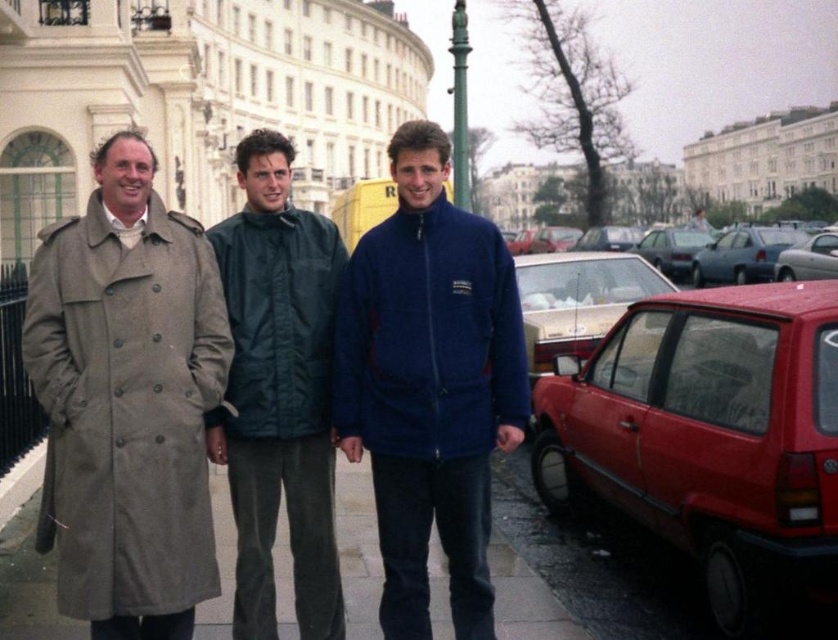
You are a pedestrian standing on the sidewalk and want to cross the street to reach the shiny red hatchback at right and the navy fleece jacket at center. Which object will you reach first?

The shiny red hatchback at right is closer to the viewer than the navy fleece jacket at center, so you will reach the shiny red hatchback at right first.

You are a pedestrian standing on the sidewalk and want to cross the street safely. The shiny red hatchback at right and the metallic silver sedan at center right are parked. Which car should you avoid walking behind because it might start moving first?

You should avoid walking behind the shiny red hatchback at right because it is in front of the metallic silver sedan at center right, meaning it has a clearer path to move forward without needing to wait for the sedan to move first.

You are a tailor who needs to determine which coat requires a longer fabric length. Based on the image, which of the two coats, the light brown fabric trench coat at left or the navy fleece jacket at center, is taller?

The light brown fabric trench coat at left is taller than the navy fleece jacket at center, so it requires a longer fabric length.